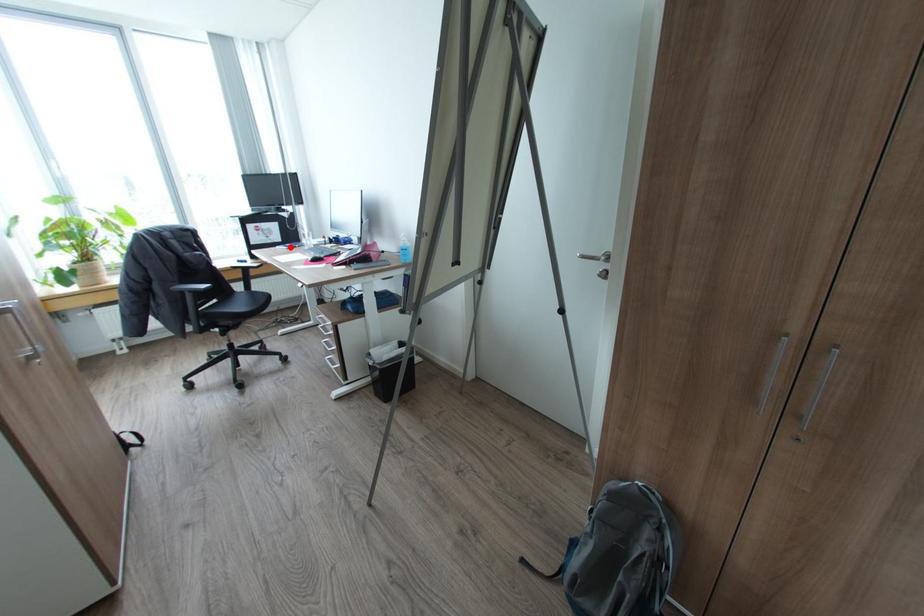
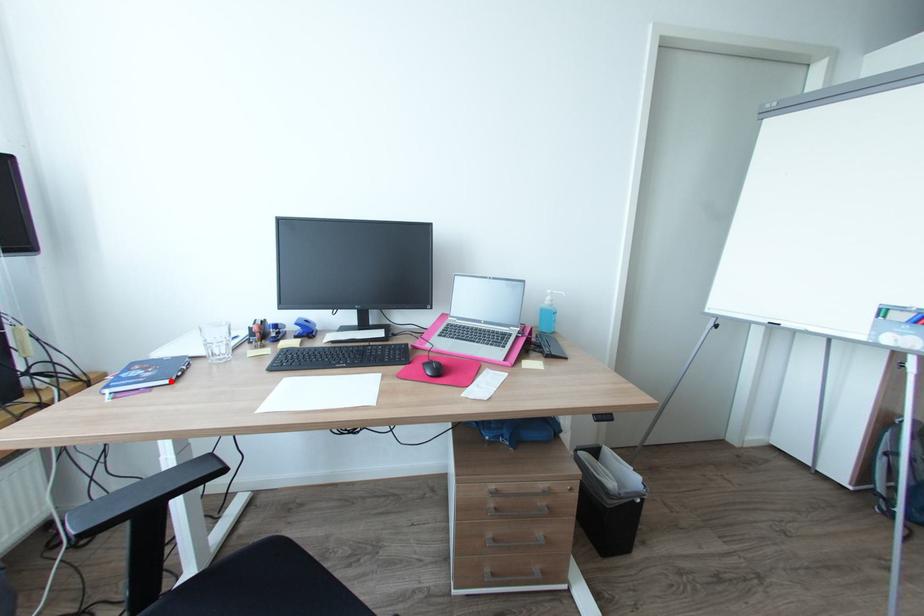
I am providing you with two images of the same scene from different viewpoints. A red point is marked on the first image and another point is marked on the second image. Do the highlighted points in image1 and image2 indicate the same real-world spot?

Yes